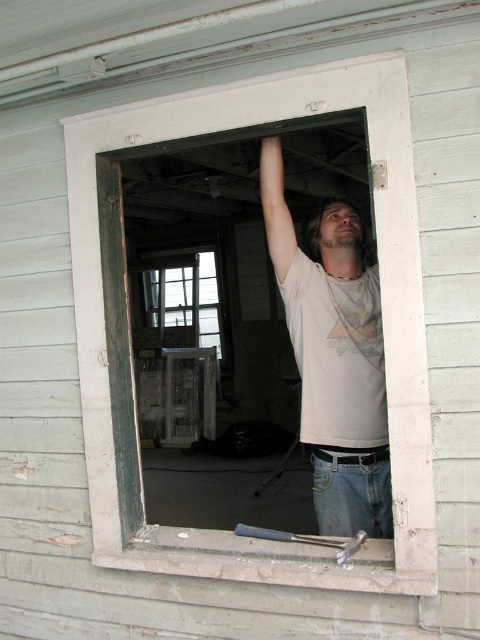
Question: Does white painted wood at center have a larger size compared to white cotton shirt at center?

Choices:
 (A) no
 (B) yes

Answer: (B)

Question: Is white painted wood at center bigger than white cotton shirt at center?

Choices:
 (A) yes
 (B) no

Answer: (A)

Question: Among these points, which one is farthest from the camera?

Choices:
 (A) (347, 392)
 (B) (84, 268)

Answer: (A)

Question: Does white painted wood at center lie behind white cotton shirt at center?

Choices:
 (A) no
 (B) yes

Answer: (A)

Question: Among these points, which one is farthest from the camera?

Choices:
 (A) (347, 262)
 (B) (332, 104)

Answer: (A)

Question: Which of the following is the closest to the observer?

Choices:
 (A) white painted wood at center
 (B) white cotton shirt at center

Answer: (A)